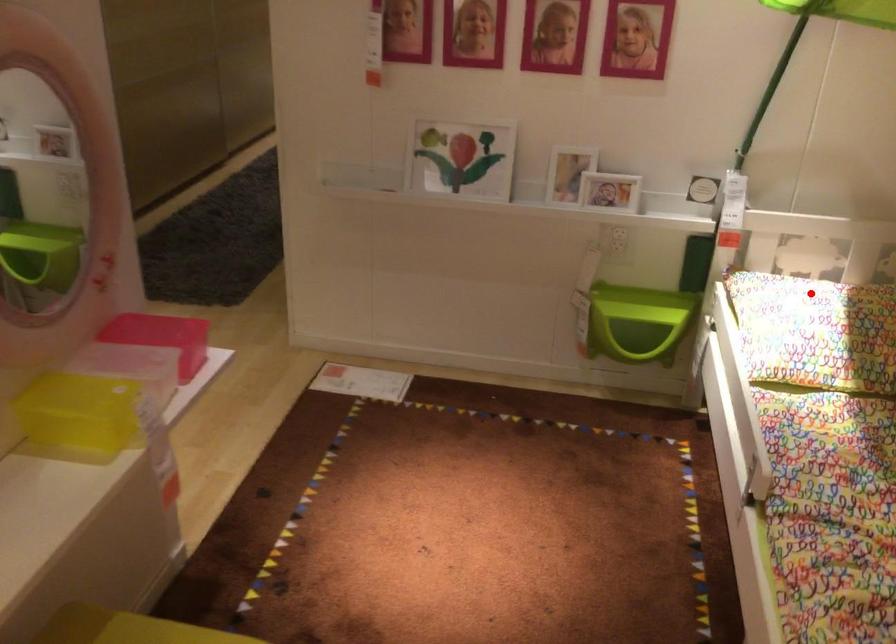
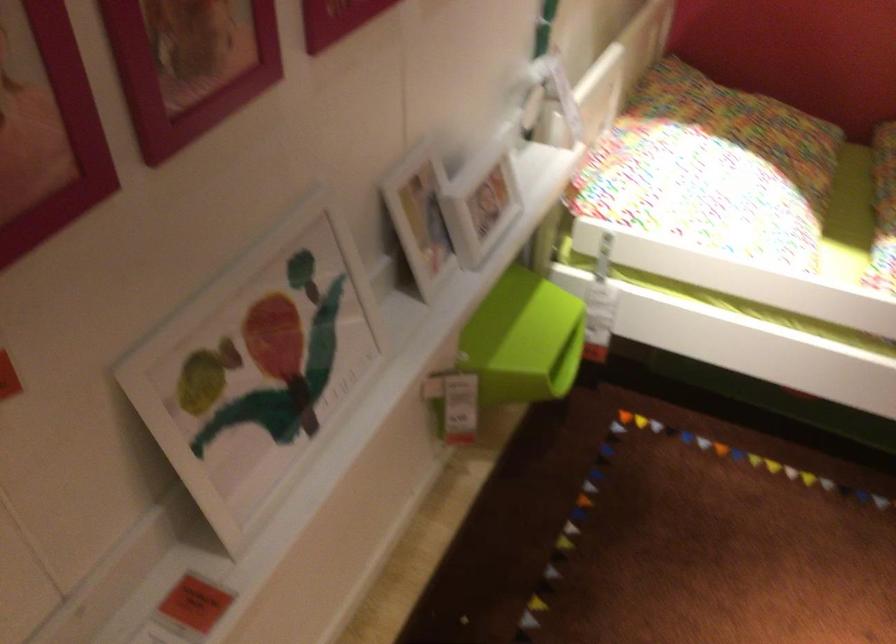
Question: I am providing you with two images of the same scene from different viewpoints. A red point is shown in image1. For the corresponding object point in image2, is it positioned nearer or farther from the camera?

Choices:
 (A) Nearer
 (B) Farther

Answer: (A)